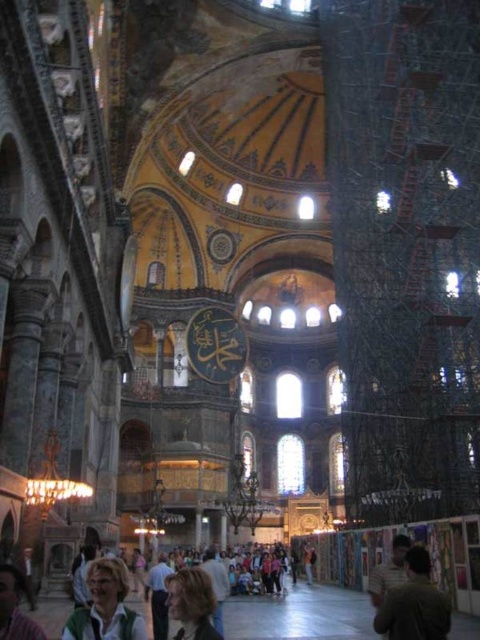
You are an art student observing the interior of a historical church. You notice two figures in the image with blonde hair at center and light brown hair at lower left. Which figure is taller?

The blonde hair at center is taller than the light brown hair at lower left.

You are standing in the grand cathedral and see a person wearing the green fabric jacket at lower left and having the light brown hair at lower left. Which part of the person is bigger?

The green fabric jacket at lower left is larger in size than the light brown hair at lower left.